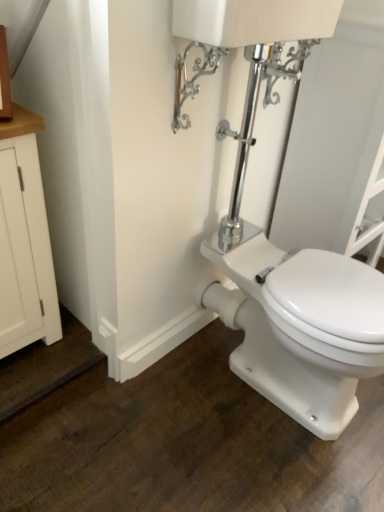
The image size is (384, 512). Find the location of `white wood cabinet at left`. white wood cabinet at left is located at coordinates (24, 240).

The height and width of the screenshot is (512, 384). Describe the element at coordinates (24, 240) in the screenshot. I see `white wood cabinet at left` at that location.

Locate an element on the screen. This screenshot has height=512, width=384. white wood cabinet at left is located at coordinates (24, 240).